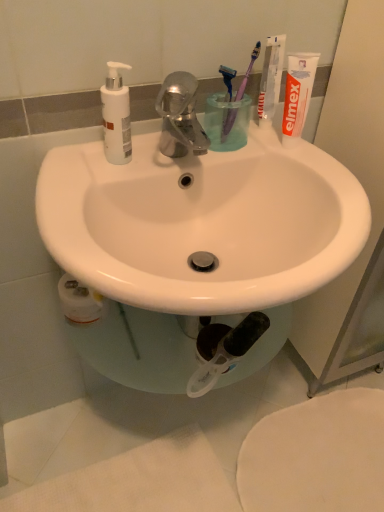
Question: Can you confirm if transparent plastic cup at center is wider than white glossy sink at center?

Choices:
 (A) no
 (B) yes

Answer: (A)

Question: Does transparent plastic cup at center have a larger size compared to white glossy sink at center?

Choices:
 (A) no
 (B) yes

Answer: (A)

Question: Considering the relative positions of transparent plastic cup at center and white glossy sink at center in the image provided, is transparent plastic cup at center to the left of white glossy sink at center from the viewer's perspective?

Choices:
 (A) yes
 (B) no

Answer: (B)

Question: Is transparent plastic cup at center far from white glossy sink at center?

Choices:
 (A) no
 (B) yes

Answer: (A)

Question: Is transparent plastic cup at center aimed at white glossy sink at center?

Choices:
 (A) yes
 (B) no

Answer: (B)

Question: Considering the relative positions of transparent plastic cup at center and white glossy sink at center in the image provided, is transparent plastic cup at center to the right of white glossy sink at center from the viewer's perspective?

Choices:
 (A) yes
 (B) no

Answer: (A)

Question: Are white matte pump bottle at upper left and transparent plastic cup at center located far from each other?

Choices:
 (A) yes
 (B) no

Answer: (B)

Question: Considering the relative sizes of white matte pump bottle at upper left and transparent plastic cup at center in the image provided, is white matte pump bottle at upper left thinner than transparent plastic cup at center?

Choices:
 (A) yes
 (B) no

Answer: (A)

Question: Considering the relative sizes of white matte pump bottle at upper left and transparent plastic cup at center in the image provided, is white matte pump bottle at upper left wider than transparent plastic cup at center?

Choices:
 (A) yes
 (B) no

Answer: (B)

Question: Is white matte pump bottle at upper left beside transparent plastic cup at center?

Choices:
 (A) no
 (B) yes

Answer: (A)

Question: Is white matte pump bottle at upper left positioned beyond the bounds of transparent plastic cup at center?

Choices:
 (A) yes
 (B) no

Answer: (A)

Question: Is white matte pump bottle at upper left at the right side of transparent plastic cup at center?

Choices:
 (A) no
 (B) yes

Answer: (A)

Question: Is transparent plastic cup at center wider than white matte bidet at lower right?

Choices:
 (A) yes
 (B) no

Answer: (B)